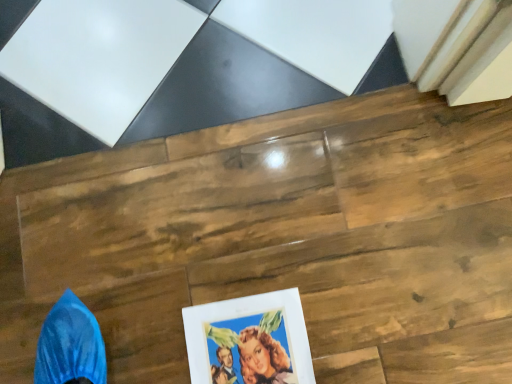
The height and width of the screenshot is (384, 512). Describe the element at coordinates (249, 340) in the screenshot. I see `matte white picture frame at lower center` at that location.

What is the approximate width of matte white picture frame at lower center?

matte white picture frame at lower center is 30.34 centimeters in width.

The width and height of the screenshot is (512, 384). What are the coordinates of `matte white picture frame at lower center` in the screenshot? It's located at (249, 340).

Where is `matte white picture frame at lower center`? The width and height of the screenshot is (512, 384). matte white picture frame at lower center is located at coordinates (249, 340).